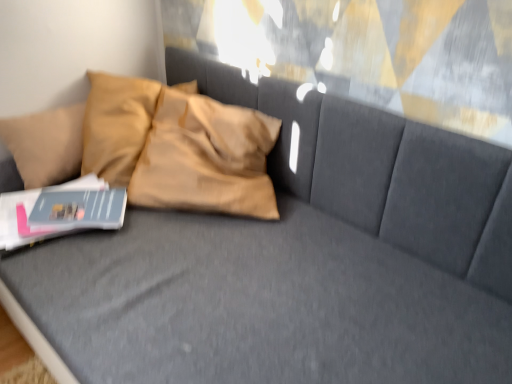
Question: Considering the relative positions of matte gray magazine at lower left and matte gray book at lower left in the image provided, is matte gray magazine at lower left to the left or to the right of matte gray book at lower left?

Choices:
 (A) left
 (B) right

Answer: (B)

Question: Considering the positions of matte gray magazine at lower left and matte gray book at lower left in the image, is matte gray magazine at lower left taller or shorter than matte gray book at lower left?

Choices:
 (A) short
 (B) tall

Answer: (A)

Question: Relative to matte gray book at lower left, is matte gray magazine at lower left in front or behind?

Choices:
 (A) behind
 (B) front

Answer: (A)

Question: In terms of height, does matte gray book at lower left look taller or shorter compared to matte gray magazine at lower left?

Choices:
 (A) short
 (B) tall

Answer: (B)

Question: In the image, is matte gray book at lower left on the left side or the right side of matte gray magazine at lower left?

Choices:
 (A) right
 (B) left

Answer: (B)

Question: Is matte gray book at lower left bigger or smaller than matte gray magazine at lower left?

Choices:
 (A) big
 (B) small

Answer: (A)

Question: Considering their positions, is matte gray book at lower left located in front of or behind matte gray magazine at lower left?

Choices:
 (A) front
 (B) behind

Answer: (A)